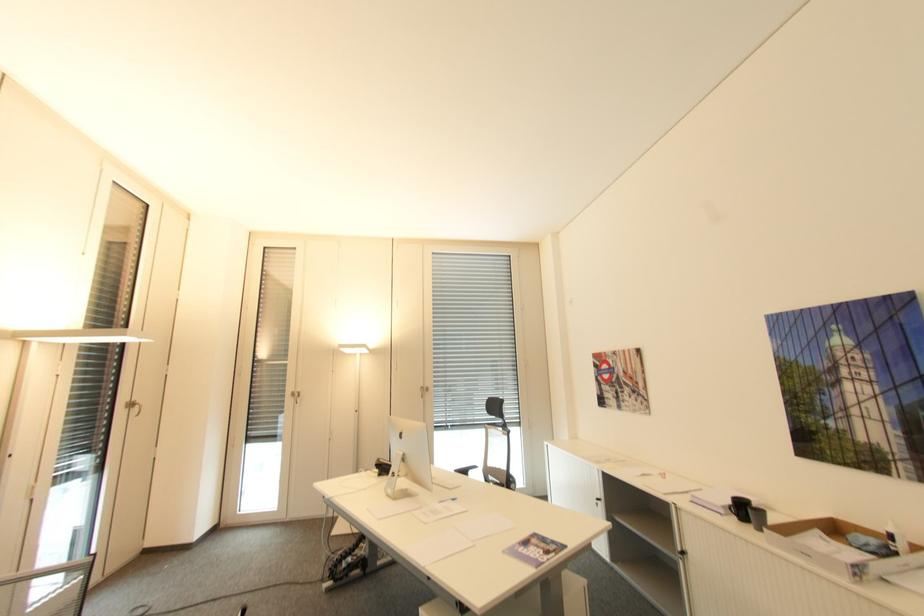
You are a GUI agent. You are given a task and a screenshot of the screen. Output one action in this format:
    pyautogui.click(x=<x>, y=<y>)
    Task: Click on the blue pen
    
    Given the screenshot: What is the action you would take?
    pyautogui.click(x=447, y=499)